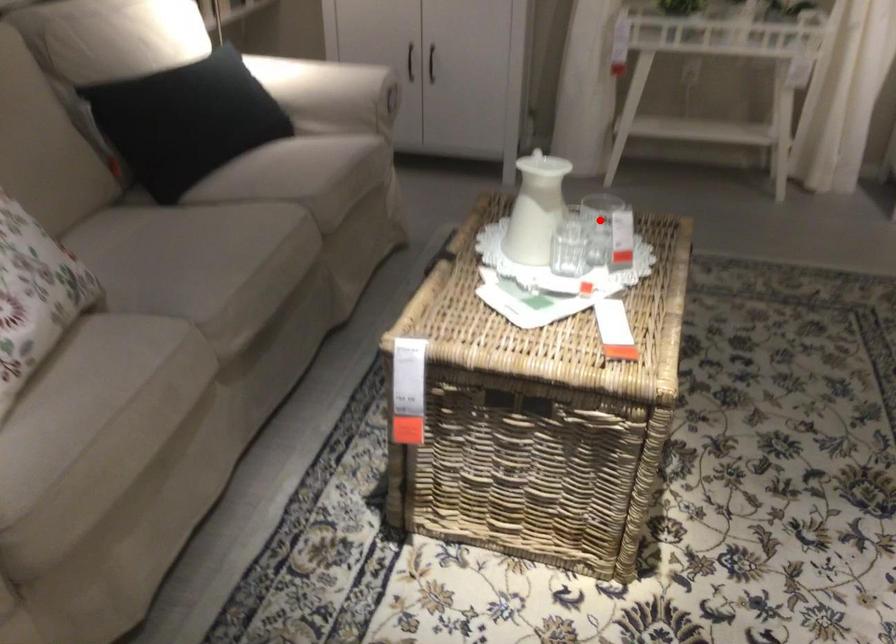
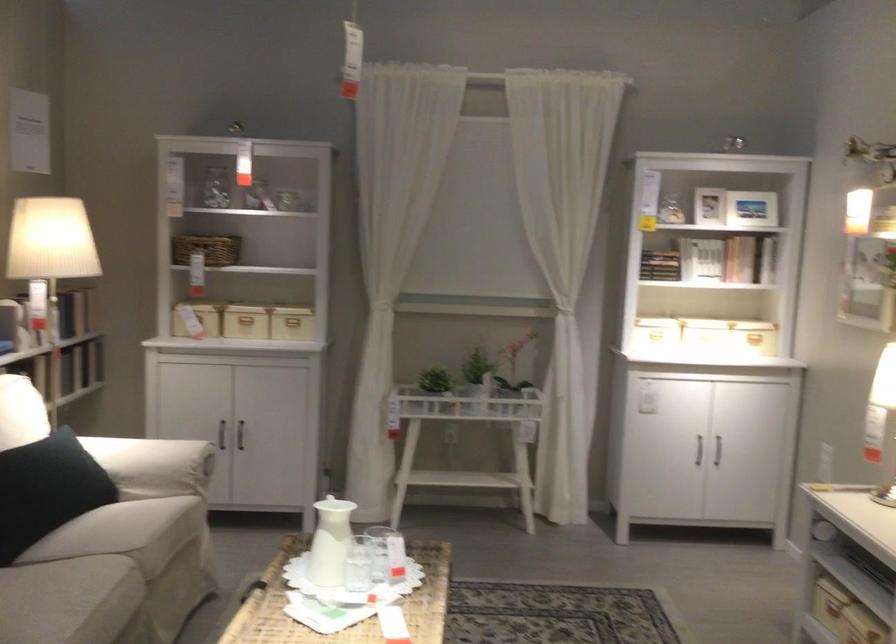
The point at the highlighted location is marked in the first image. Where is the corresponding point in the second image?

(386, 554)